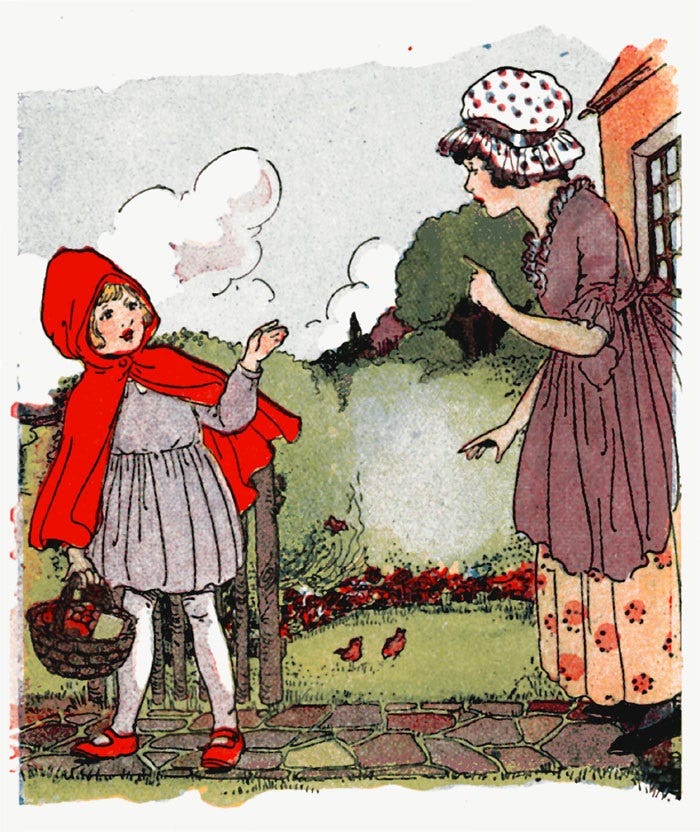
This screenshot has height=832, width=700. I want to click on stockings, so click(203, 675).